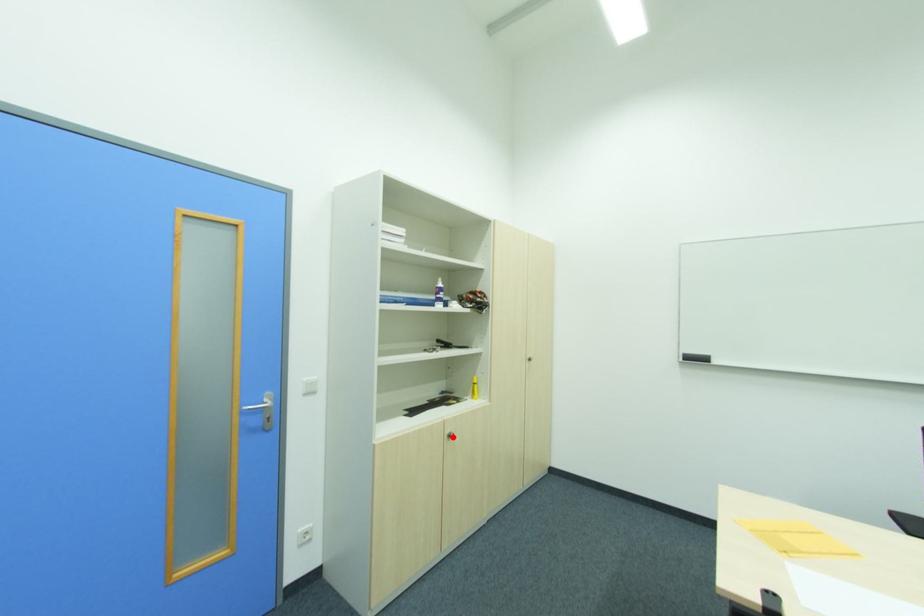
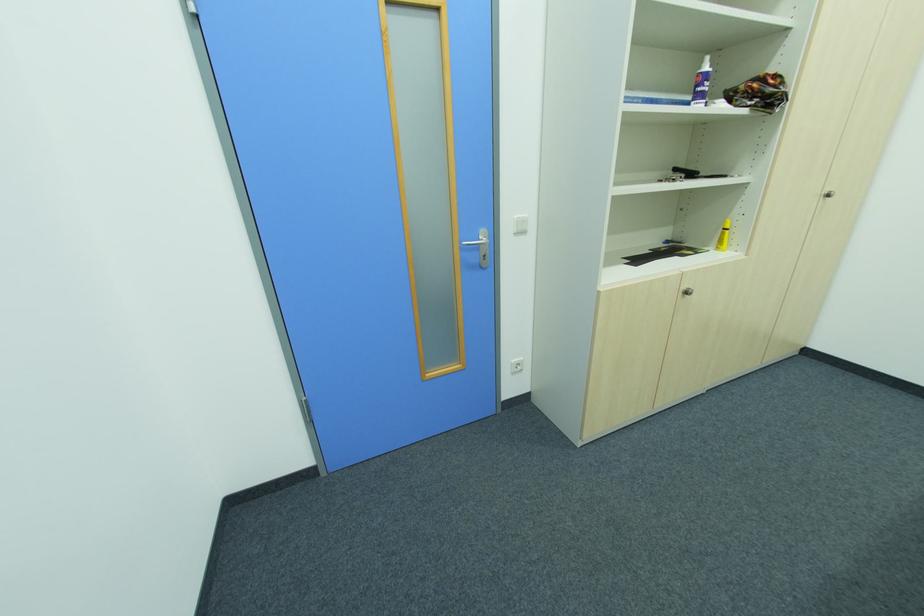
Where in the second image is the point corresponding to the highlighted location from the first image?

(689, 294)